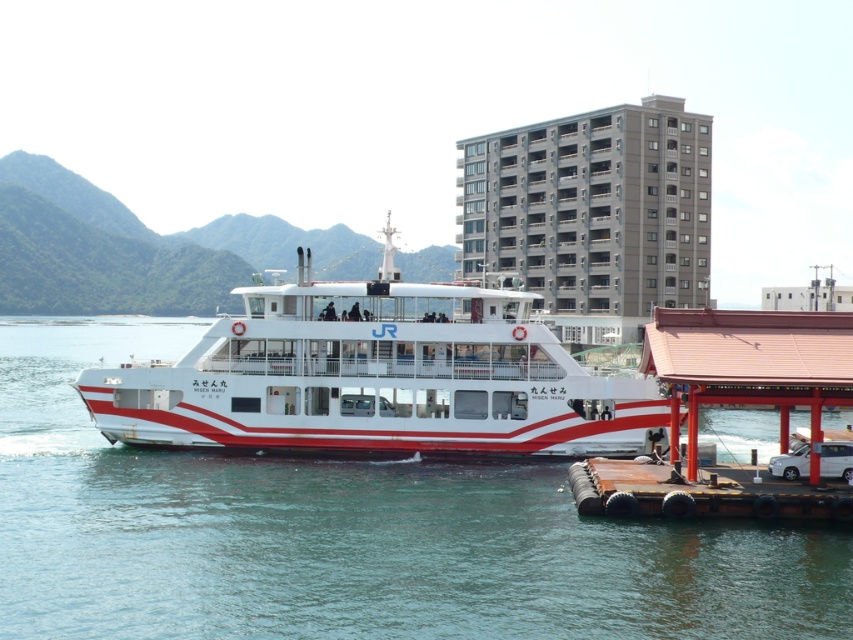
Who is more forward, (57, 324) or (258, 378)?

Point (258, 378) is in front.

Who is shorter, white water at center or white glossy ferry at center?

white water at center

Is point (161, 333) farther from viewer compared to point (325, 406)?

Yes, it is behind point (325, 406).

Where is `white water at center`? Image resolution: width=853 pixels, height=640 pixels. white water at center is located at coordinates (347, 534).